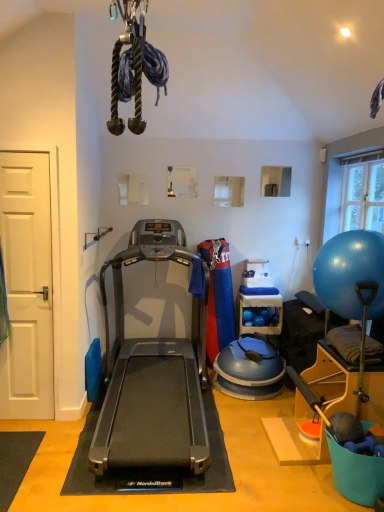
Question: Considering the positions of white matte door at left and wooden shelf at center in the image, is white matte door at left wider or thinner than wooden shelf at center?

Choices:
 (A) thin
 (B) wide

Answer: (A)

Question: From a real-world perspective, is white matte door at left above or below wooden shelf at center?

Choices:
 (A) above
 (B) below

Answer: (A)

Question: Considering the real-world distances, which object is closest to the silver metallic treadmill at center?

Choices:
 (A) wooden shelf at center
 (B) transparent glass window at upper right
 (C) white matte door at left
 (D) blue rubber ball at right

Answer: (C)

Question: Which object is positioned farthest from the silver metallic treadmill at center?

Choices:
 (A) blue rubber ball at right
 (B) white matte door at left
 (C) transparent glass window at upper right
 (D) wooden shelf at center

Answer: (C)